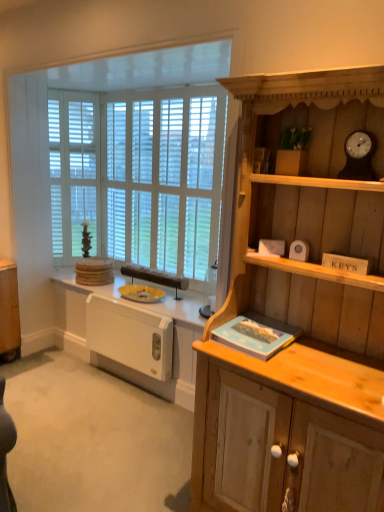
Identify the location of empty space that is ontop of white plastic radiator at lower left. coord(126,309).